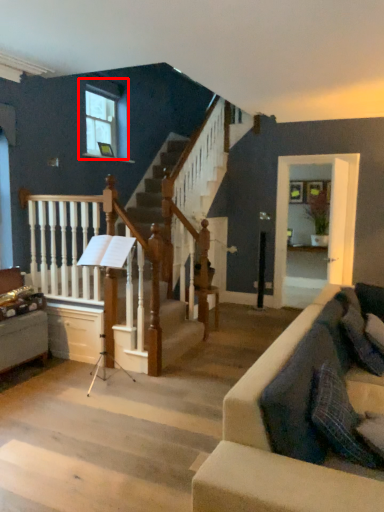
Question: Observing the image, what is the correct spatial positioning of window (annotated by the red box) in reference to rail?

Choices:
 (A) left
 (B) right

Answer: (A)